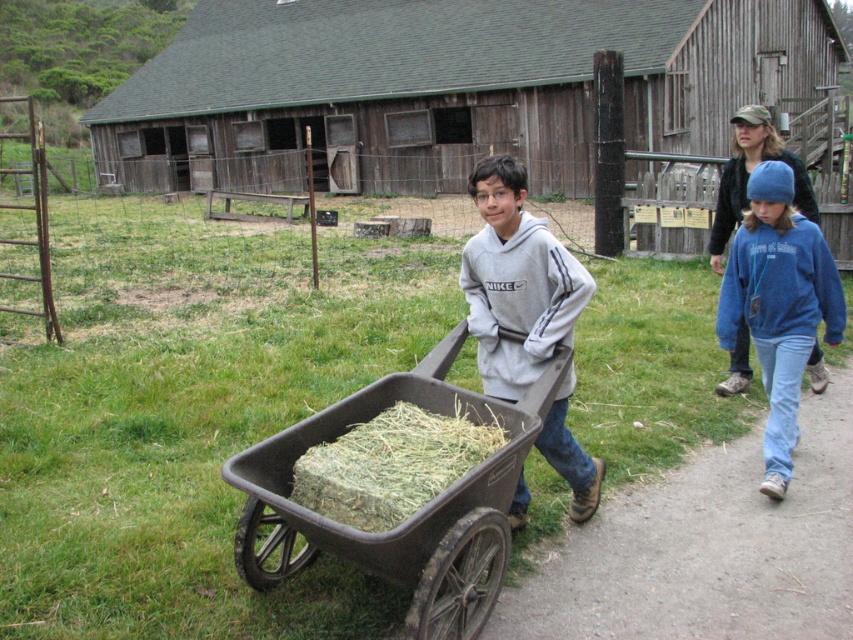
You are standing at the edge of the dirt path at lower right and want to reach the dark gray plastic cart at center. Which direction should you move to get closer to the cart?

The dirt path at lower right is located below the dark gray plastic cart at center, so you should move upward to reach the cart.

You are a photographer trying to capture the scene. You want to position yourself so that the gray fleece hoodie at center and the green straw at center are both in frame. Which object should you place on the left side of your camera frame?

You should place the green straw at center on the left side of your camera frame because the gray fleece hoodie at center is to the right of it.

What is the object located at the coordinate point (515,282) in the image?

The object located at the coordinate point (515,282) is the gray fleece hoodie at center.